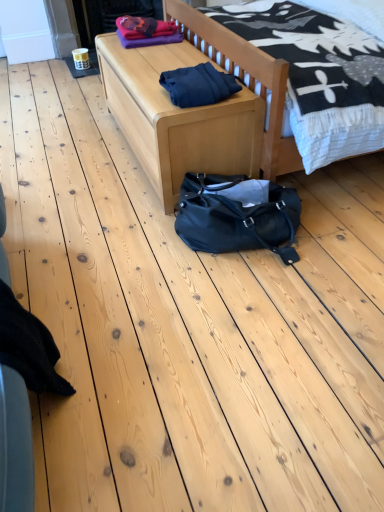
Question: In the image, is dark blue fabric at center positioned in front of or behind light wood bed at center?

Choices:
 (A) behind
 (B) front

Answer: (A)

Question: Is dark blue fabric at center spatially inside light wood bed at center, or outside of it?

Choices:
 (A) inside
 (B) outside

Answer: (B)

Question: Which is nearer to the light wood bed at center?

Choices:
 (A) dark blue fabric at center
 (B) light wood bench at center
 (C) black fabric at lower left

Answer: (A)

Question: Which of these objects is positioned closest to the light wood bed at center?

Choices:
 (A) light wood bench at center
 (B) black fabric at lower left
 (C) dark blue fabric at center

Answer: (C)